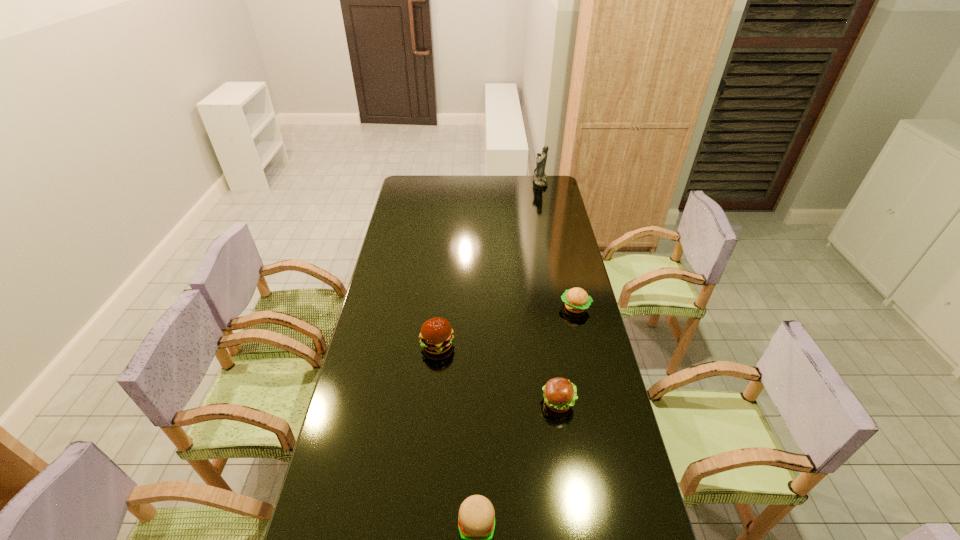
The width and height of the screenshot is (960, 540). Identify the location of vacant space that satisfies the following two spatial constraints: 1. on the front-facing side of the figurine; 2. on the left side of the farthest hamburger. (566, 307).

Locate an element on the screen. The height and width of the screenshot is (540, 960). vacant space that satisfies the following two spatial constraints: 1. on the front-facing side of the farthest object; 2. on the right side of the fourth nearest object is located at coordinates (566, 307).